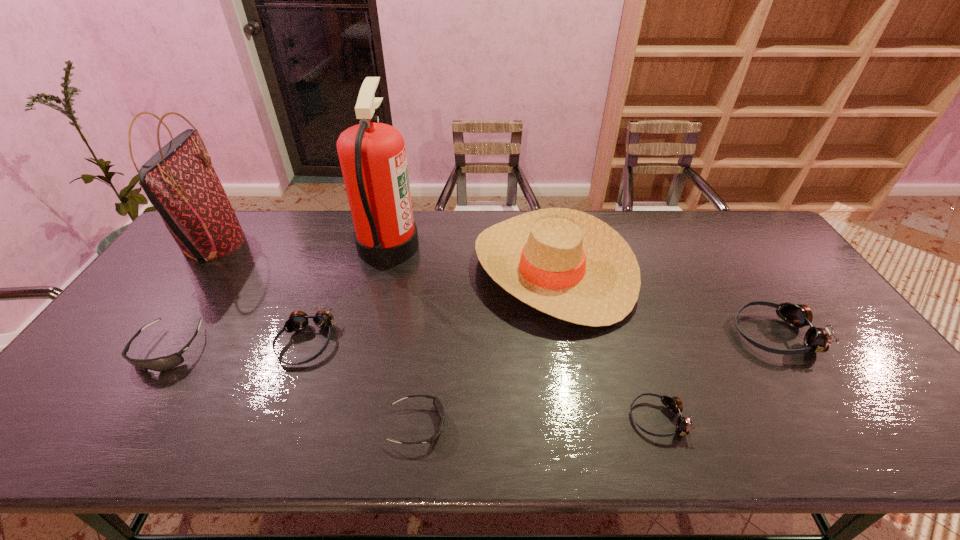
The width and height of the screenshot is (960, 540). I want to click on red fire extinguisher, so click(372, 155).

Image resolution: width=960 pixels, height=540 pixels. Identify the location of handbag. (179, 180).

The width and height of the screenshot is (960, 540). What are the coordinates of `the third tallest object` in the screenshot? It's located at (566, 263).

Image resolution: width=960 pixels, height=540 pixels. What are the coordinates of `the rightmost bronze goggles` in the screenshot? It's located at click(x=818, y=340).

Locate an element on the screen. This screenshot has height=540, width=960. the tallest goggles is located at coordinates (818, 340).

Where is `the leftmost bronze goggles`? the leftmost bronze goggles is located at coordinates (298, 320).

This screenshot has width=960, height=540. I want to click on the second goggles from left to right, so click(298, 320).

The width and height of the screenshot is (960, 540). Find the location of `the bigger black goggles`. the bigger black goggles is located at coordinates (163, 363).

What are the coordinates of `the leftmost goggles` in the screenshot? It's located at (163, 363).

This screenshot has height=540, width=960. I want to click on the second bronze goggles from left to right, so (674, 404).